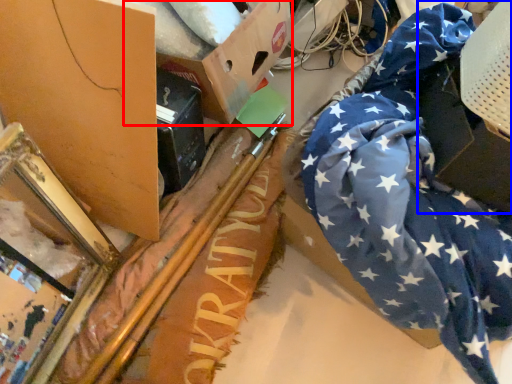
Question: Among these objects, which one is farthest to the camera, cardboard box (highlighted by a red box) or cardboard box (highlighted by a blue box)?

Choices:
 (A) cardboard box
 (B) cardboard box

Answer: (A)